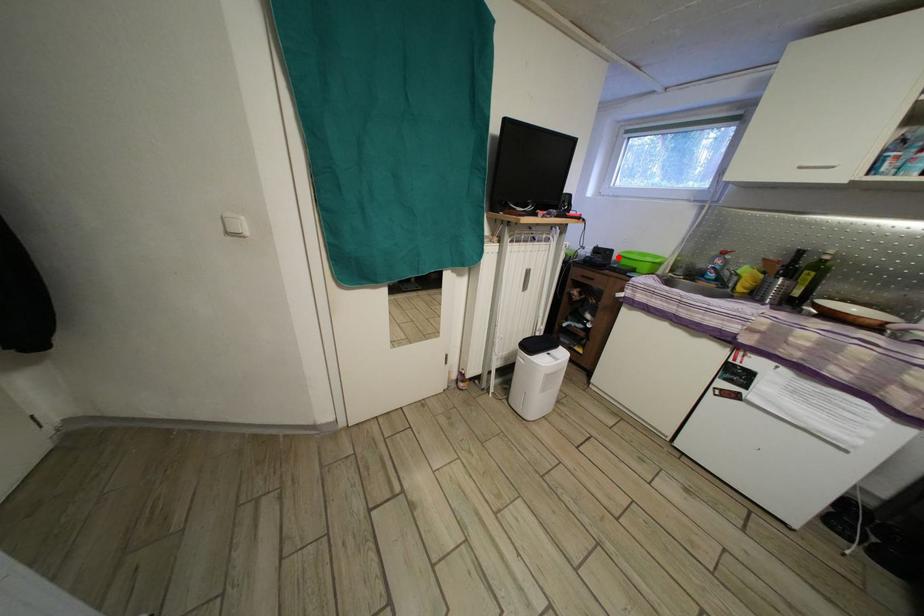
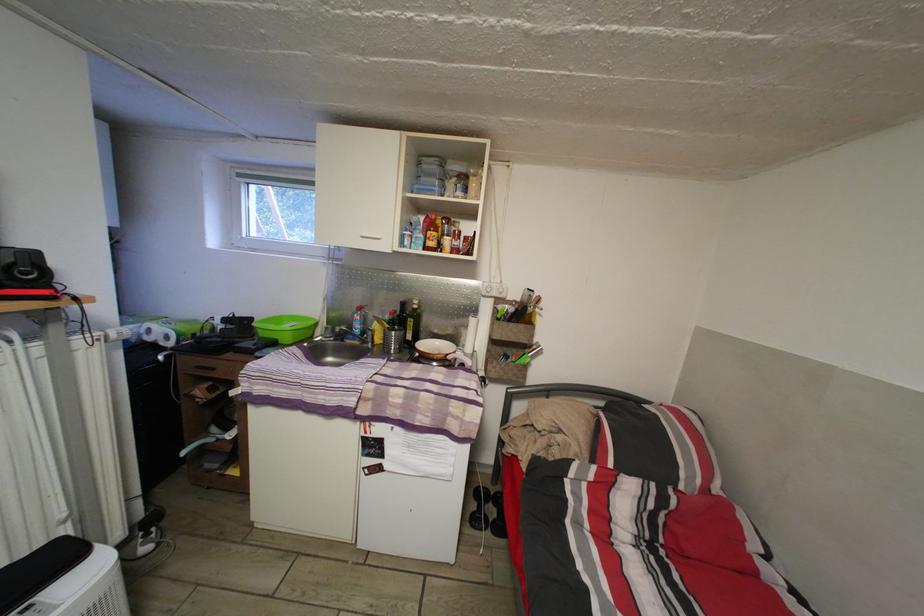
In the second image, find the point that corresponds to the highlighted location in the first image.

(257, 326)